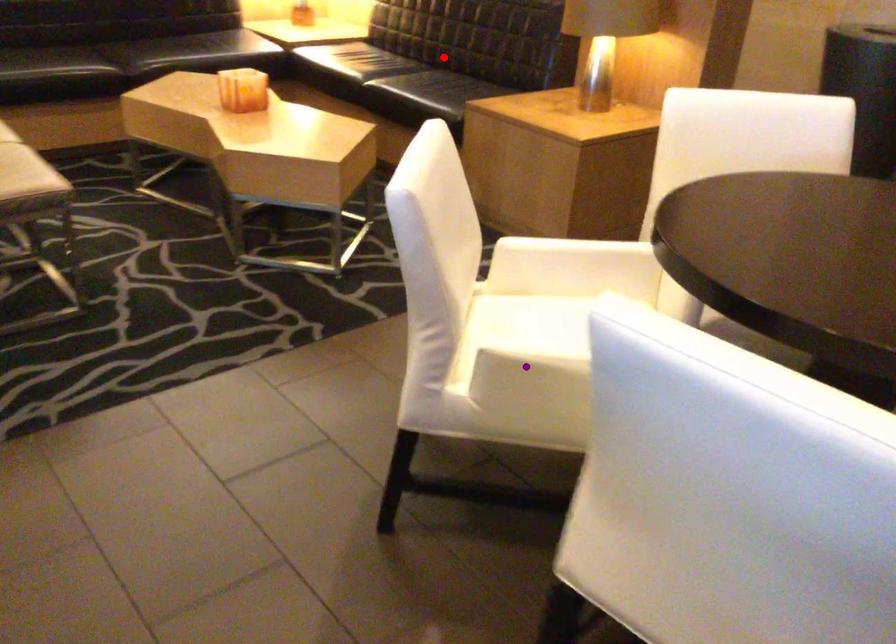
Order these from nearest to farthest:
orange point
red point
purple point

red point < orange point < purple point